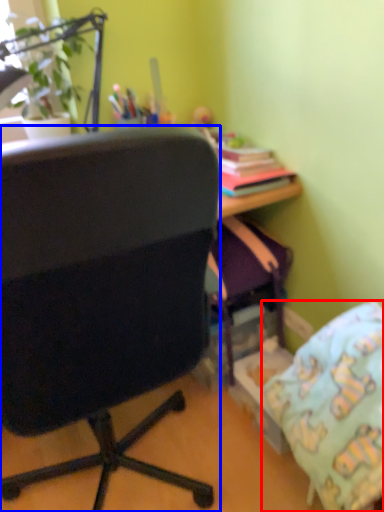
Question: Which point is further to the camera, pillow (highlighted by a red box) or chair (highlighted by a blue box)?

Choices:
 (A) pillow
 (B) chair

Answer: (A)